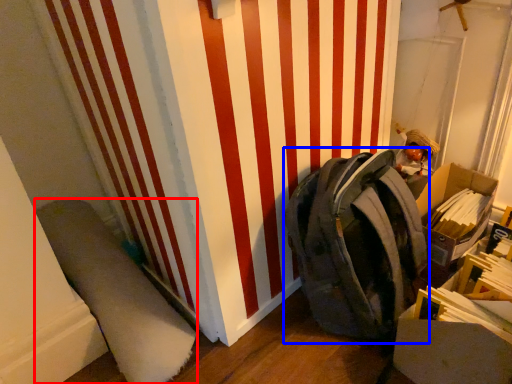
Question: Which of the following is the closest to the observer, wide (highlighted by a red box) or backpack (highlighted by a blue box)?

Choices:
 (A) wide
 (B) backpack

Answer: (B)